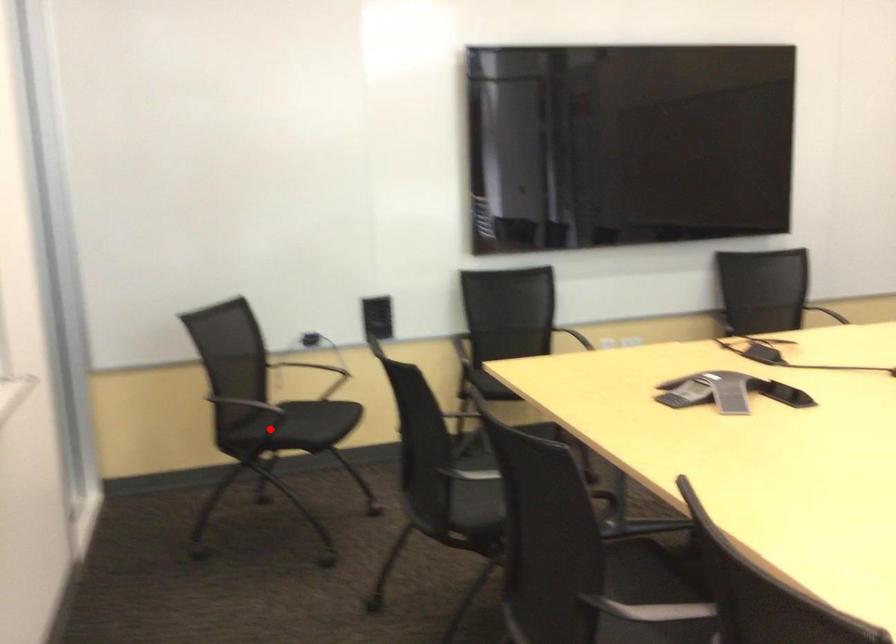
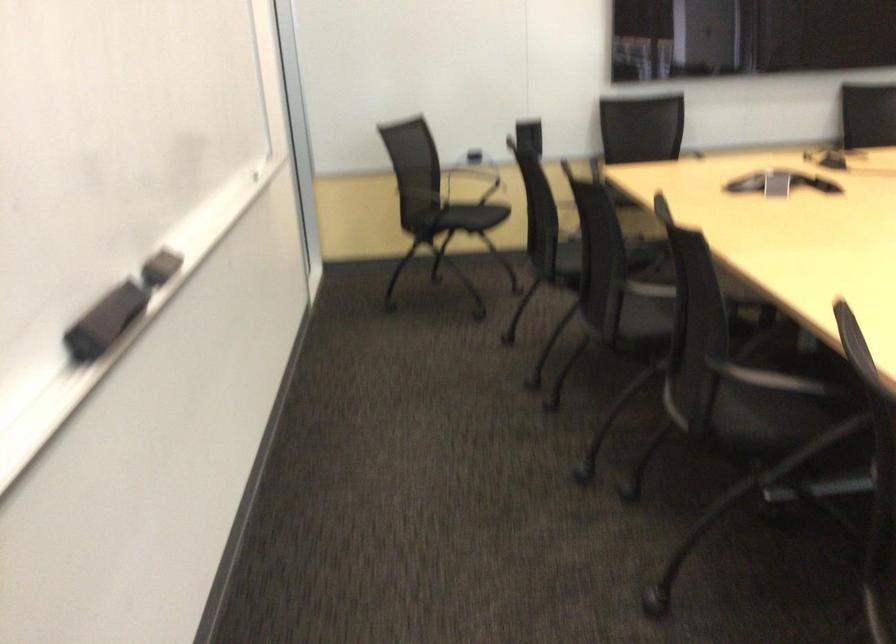
Question: I am providing you with two images of the same scene from different viewpoints. In image1, a red point is highlighted. Considering the same 3D point in image2, which of the following is correct?

Choices:
 (A) It is closer
 (B) It is farther

Answer: (B)